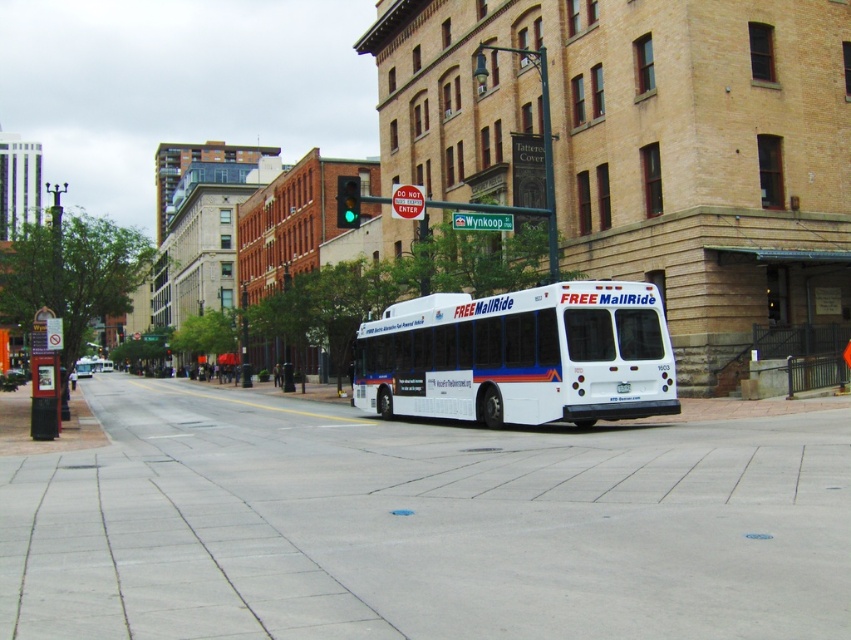
Consider the image. Can you confirm if gray concrete pavement at center is shorter than white matte bus at center?

Indeed, gray concrete pavement at center has a lesser height compared to white matte bus at center.

Between point (387, 552) and point (597, 388), which one is positioned behind?

The point (597, 388) is behind.

Find the location of a particular element. The width and height of the screenshot is (851, 640). gray concrete pavement at center is located at coordinates (421, 525).

At what (x,y) coordinates should I click in order to perform the action: click on gray concrete pavement at center. Please return your answer as a coordinate pair (x, y). The width and height of the screenshot is (851, 640). Looking at the image, I should click on (421, 525).

Which is more to the left, gray concrete pavement at center or metallic sign at left?

From the viewer's perspective, metallic sign at left appears more on the left side.

Who is more forward, (104, 566) or (49, 433)?

Positioned in front is point (104, 566).

The height and width of the screenshot is (640, 851). Find the location of `gray concrete pavement at center`. gray concrete pavement at center is located at coordinates (421, 525).

Is white matte bus at center to the left of metallic sign at left from the viewer's perspective?

Incorrect, white matte bus at center is not on the left side of metallic sign at left.

Based on the photo, is white matte bus at center shorter than metallic sign at left?

No.

Find the location of a particular element. The image size is (851, 640). white matte bus at center is located at coordinates (520, 355).